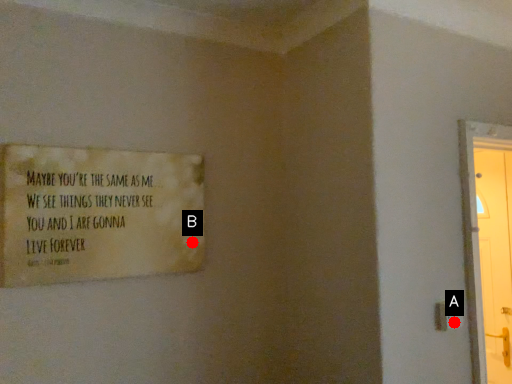
Question: Two points are circled on the image, labeled by A and B beside each circle. Which point appears closest to the camera in this image?

Choices:
 (A) A is closer
 (B) B is closer

Answer: (A)